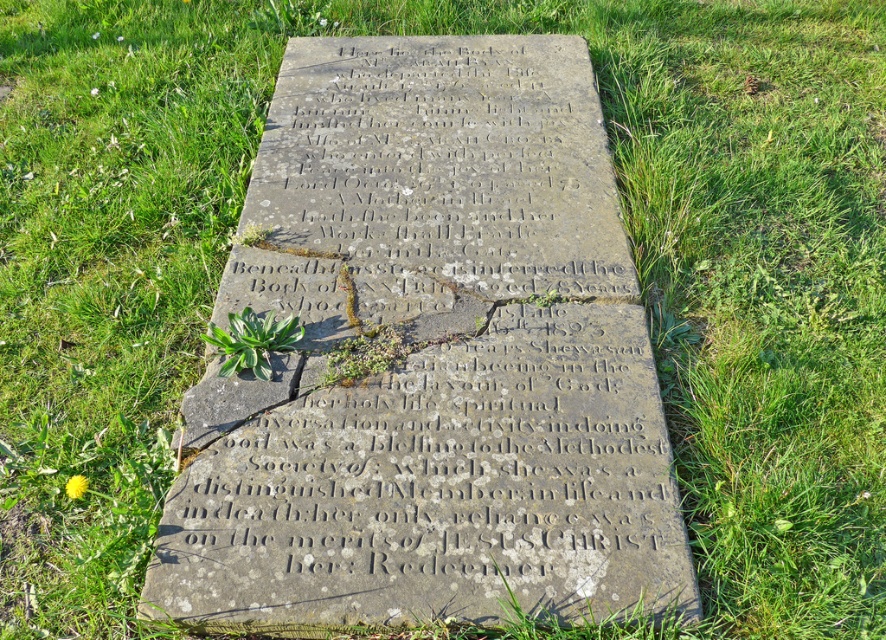
Between green leafy plant at center and yellow petal at lower left, which one has more height?

With more height is green leafy plant at center.

Does green leafy plant at center have a lesser height compared to yellow petal at lower left?

In fact, green leafy plant at center may be taller than yellow petal at lower left.

The height and width of the screenshot is (640, 886). In order to click on green leafy plant at center in this screenshot , I will do `click(253, 340)`.

Find the location of a particular element. Image resolution: width=886 pixels, height=640 pixels. green leafy plant at center is located at coordinates (253, 340).